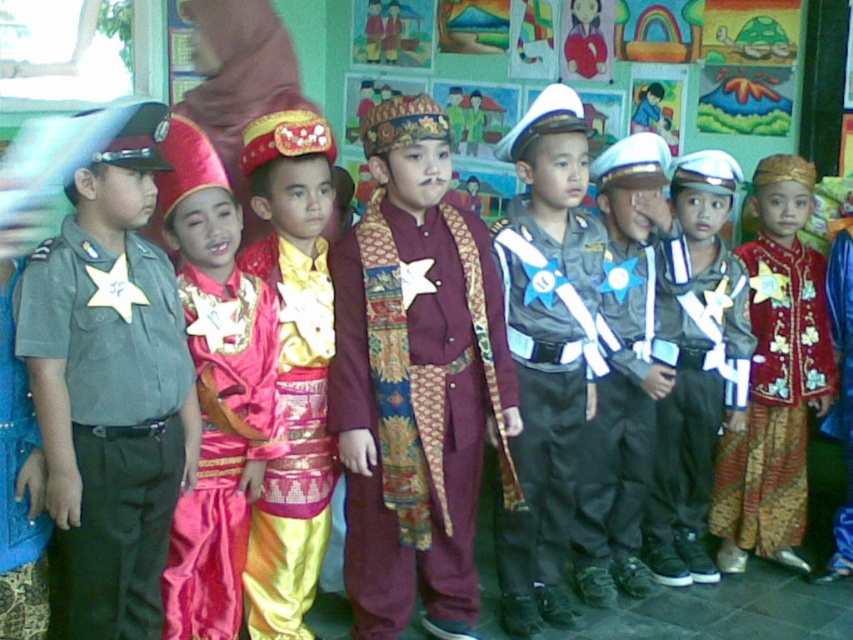
Which is behind, point (207, 540) or point (666, 563)?

Positioned behind is point (666, 563).

Which is more to the right, shiny red fabric costume at center or matte black uniform at center?

matte black uniform at center

Image resolution: width=853 pixels, height=640 pixels. Identify the location of shiny red fabric costume at center. (216, 388).

At what (x,y) coordinates should I click in order to perform the action: click on shiny red fabric costume at center. Please return your answer as a coordinate pair (x, y). The width and height of the screenshot is (853, 640). Looking at the image, I should click on (216, 388).

Can you confirm if shiny pink fabric at center is shorter than red satin robe at center?

Result: Incorrect, shiny pink fabric at center's height does not fall short of red satin robe at center's.

Between point (260, 616) and point (786, 200), which one is positioned in front?

Point (260, 616)

Find the location of `shiny pink fabric at center`. shiny pink fabric at center is located at coordinates [x=292, y=365].

Who is more distant from viewer, (120, 577) or (207, 376)?

The point (207, 376) is more distant.

Does matte gray uniform at left have a smaller size compared to shiny red fabric costume at center?

Incorrect, matte gray uniform at left is not smaller in size than shiny red fabric costume at center.

The width and height of the screenshot is (853, 640). Describe the element at coordinates (109, 390) in the screenshot. I see `matte gray uniform at left` at that location.

Where is `matte gray uniform at left`? matte gray uniform at left is located at coordinates (109, 390).